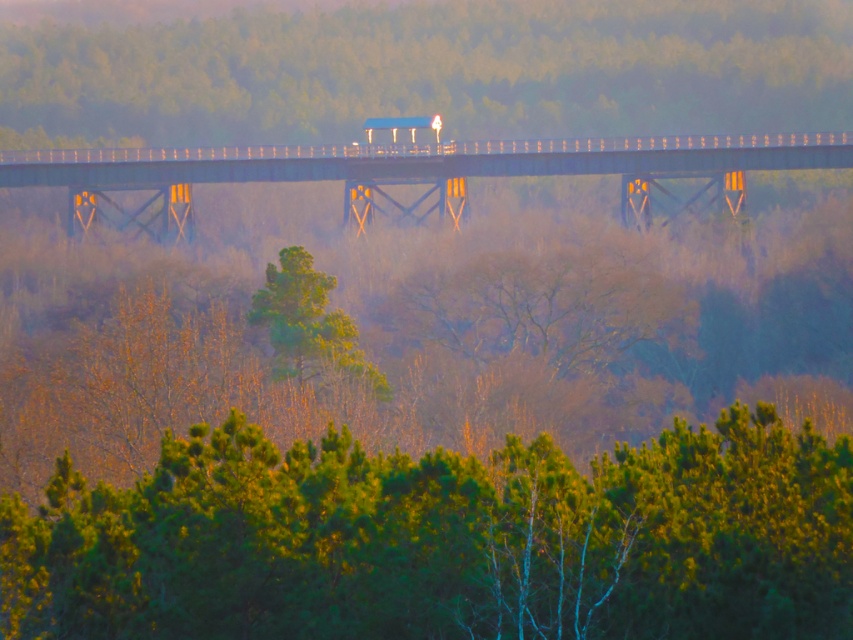
Question: Based on their relative distances, which object is nearer to the green matte tree at center?

Choices:
 (A) green leafy tree at lower center
 (B) metal bridge at center
 (C) foggy haze at upper center

Answer: (B)

Question: Among these points, which one is farthest from the camera?

Choices:
 (A) (271, 280)
 (B) (33, 182)
 (C) (727, 131)
 (D) (474, 490)

Answer: (C)

Question: Can you confirm if metal bridge at center is wider than green matte tree at center?

Choices:
 (A) yes
 (B) no

Answer: (A)

Question: Is foggy haze at upper center thinner than green matte tree at center?

Choices:
 (A) yes
 (B) no

Answer: (B)

Question: Which of the following is the farthest from the observer?

Choices:
 (A) green matte tree at center
 (B) foggy haze at upper center

Answer: (B)

Question: Is green leafy tree at lower center positioned before green matte tree at center?

Choices:
 (A) yes
 (B) no

Answer: (A)